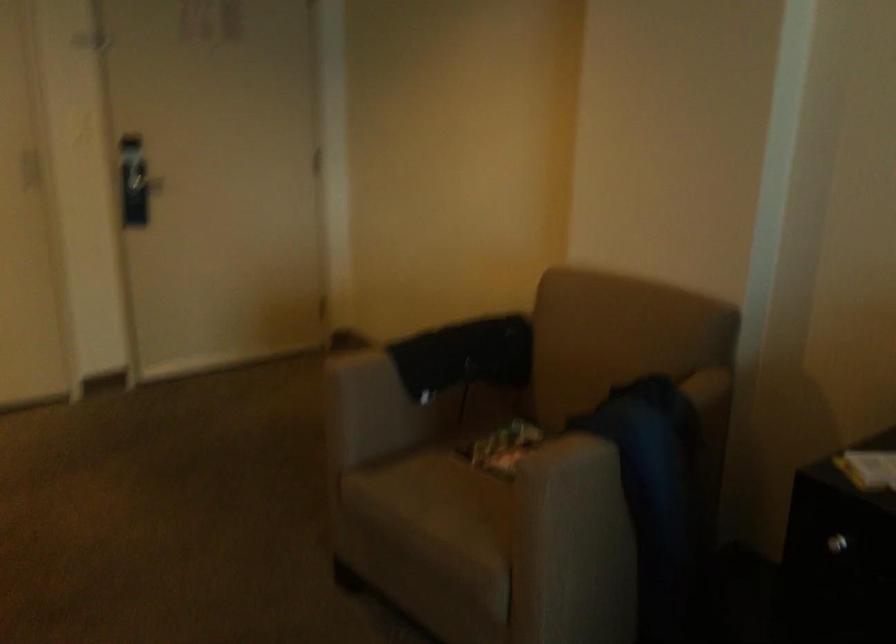
I want to click on drawer handle, so click(833, 556).